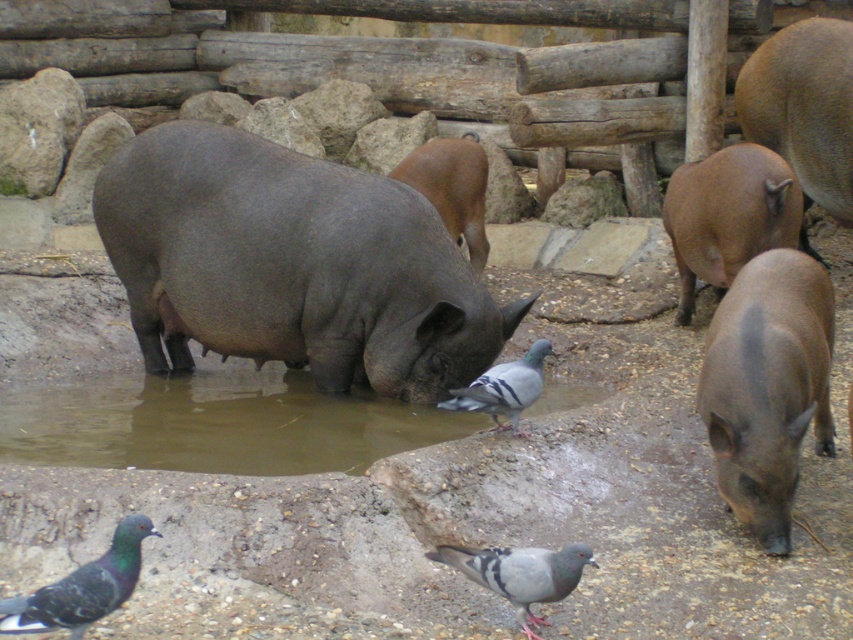
You are a zookeeper trying to locate the gray matte hippo at center. According to the coordinates provided, where exactly is the gray matte hippo positioned in the scene?

The gray matte hippo at center is located at point coordinates of 0.414 on the x axis and 0.342 on the y axis.

You are a zookeeper observing the pigeons in the enclosure. You notice two pigeons labeled as gray speckled pigeon at lower left and gray speckled pigeon at center. Which pigeon is shorter in height?

The gray speckled pigeon at lower left is shorter than the gray speckled pigeon at center.